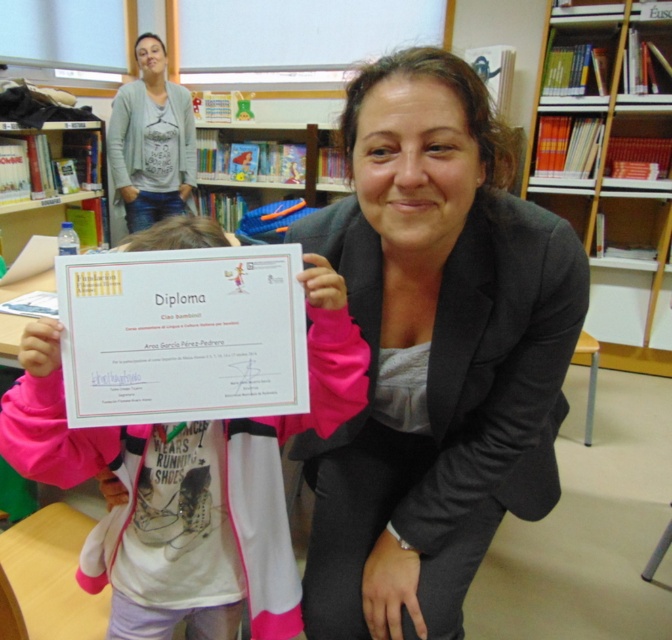
In the scene shown: You are a visitor in the library and want to take a photo of the wooden bookshelf at upper right without including the gray cardigan at upper left in the frame. How can you position yourself to achieve this?

Since the wooden bookshelf at upper right is closer to the viewer than the gray cardigan at upper left, you can move closer to the wooden bookshelf at upper right and angle your camera so that the gray cardigan at upper left is out of the frame.

You are standing in the library scene and want to place a small sticker on the point that is closer to you. Which point should you choose between point (450, 296) and point (153, 202)?

Point (450, 296) is closer to the viewer than point (153, 202), so you should choose point (450, 296) to place the sticker.

You are an observer in the scene. You see the matte black blazer at center and the gray cardigan at upper left. Which clothing item is positioned lower in the image?

The matte black blazer at center is positioned lower than the gray cardigan at upper left.